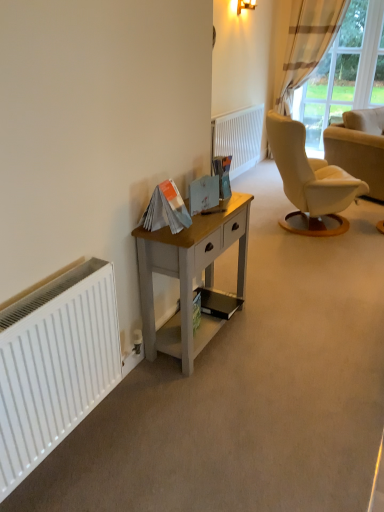
Question: Is matte gold wall sconce at upper center facing towards white textured radiator at center, the 2th radiator when ordered from left to right?

Choices:
 (A) yes
 (B) no

Answer: (B)

Question: Is matte gold wall sconce at upper center in contact with white textured radiator at center, the second radiator in the bottom-to-top sequence?

Choices:
 (A) no
 (B) yes

Answer: (A)

Question: Is matte gold wall sconce at upper center further to the viewer compared to white textured radiator at center, the first radiator from the right?

Choices:
 (A) yes
 (B) no

Answer: (A)

Question: Is matte gold wall sconce at upper center turned away from white textured radiator at center, the second radiator in the bottom-to-top sequence?

Choices:
 (A) no
 (B) yes

Answer: (A)

Question: Is matte gold wall sconce at upper center not within white textured radiator at center, the 2th radiator when ordered from left to right?

Choices:
 (A) yes
 (B) no

Answer: (A)

Question: Do you think white fabric chair at right is within white textured radiator at center, the first radiator from the right, or outside of it?

Choices:
 (A) outside
 (B) inside

Answer: (A)

Question: From the image's perspective, is white fabric chair at right positioned above or below white textured radiator at center, positioned as the 2th radiator in front-to-back order?

Choices:
 (A) above
 (B) below

Answer: (B)

Question: Looking at the image, does white fabric chair at right seem bigger or smaller compared to white textured radiator at center, which appears as the 1th radiator when viewed from the back?

Choices:
 (A) small
 (B) big

Answer: (B)

Question: Considering their positions, is white fabric chair at right located in front of or behind white textured radiator at center, the second radiator in the bottom-to-top sequence?

Choices:
 (A) behind
 (B) front

Answer: (B)

Question: Considering the positions of point pyautogui.click(x=340, y=96) and point pyautogui.click(x=286, y=61), is point pyautogui.click(x=340, y=96) closer or farther from the camera than point pyautogui.click(x=286, y=61)?

Choices:
 (A) farther
 (B) closer

Answer: (B)

Question: Considering the positions of plaid fabric curtain at upper right and brown striped fabric curtain at upper right in the image, is plaid fabric curtain at upper right bigger or smaller than brown striped fabric curtain at upper right?

Choices:
 (A) big
 (B) small

Answer: (B)

Question: Considering the relative positions of plaid fabric curtain at upper right and brown striped fabric curtain at upper right in the image provided, is plaid fabric curtain at upper right to the left or to the right of brown striped fabric curtain at upper right?

Choices:
 (A) right
 (B) left

Answer: (A)

Question: From a real-world perspective, is plaid fabric curtain at upper right physically located above or below brown striped fabric curtain at upper right?

Choices:
 (A) above
 (B) below

Answer: (A)

Question: In terms of width, does light gray wood desk at center look wider or thinner when compared to white matte radiator at left, the 2th radiator in the top-to-bottom sequence?

Choices:
 (A) wide
 (B) thin

Answer: (A)

Question: Is light gray wood desk at center to the left or to the right of white matte radiator at left, the first radiator from the bottom, in the image?

Choices:
 (A) left
 (B) right

Answer: (B)